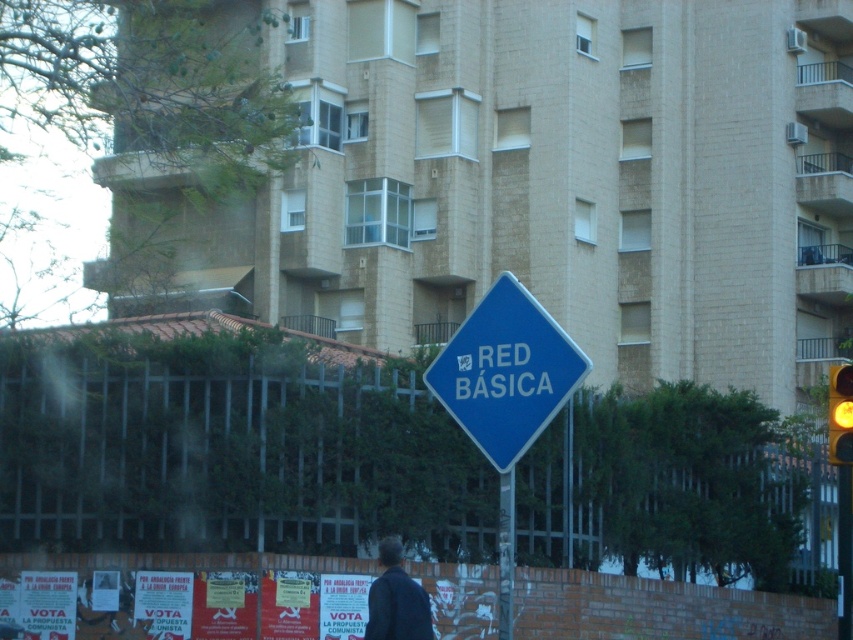
Can you confirm if blue plastic sign at center is shorter than metallic pole at center?

Incorrect, blue plastic sign at center's height does not fall short of metallic pole at center's.

Does blue plastic sign at center have a larger size compared to metallic pole at center?

Correct, blue plastic sign at center is larger in size than metallic pole at center.

Is point (576, 364) closer to viewer compared to point (511, 524)?

That is True.

At what (x,y) coordinates should I click in order to perform the action: click on blue plastic sign at center. Please return your answer as a coordinate pair (x, y). Image resolution: width=853 pixels, height=640 pixels. Looking at the image, I should click on (506, 372).

Does blue plastic sign at center have a lesser width compared to dark blue jacket at lower center?

No.

Which is in front, point (521, 291) or point (386, 545)?

Point (521, 291)

Identify the location of blue plastic sign at center. The width and height of the screenshot is (853, 640). (506, 372).

Identify the location of blue plastic sign at center. (506, 372).

Can you confirm if blue plastic sign at center is positioned below yellow glass traffic light at right?

No, blue plastic sign at center is not below yellow glass traffic light at right.

Locate an element on the screen. This screenshot has height=640, width=853. blue plastic sign at center is located at coordinates (506, 372).